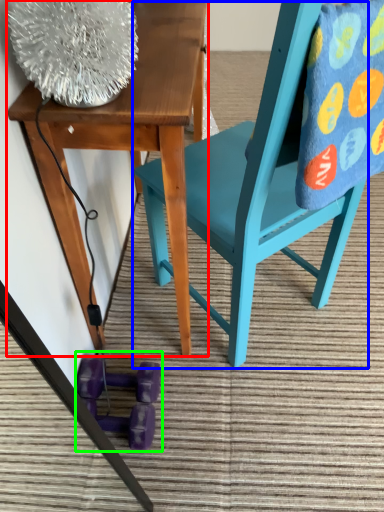
Question: Which object is the farthest from table (highlighted by a red box)? Choose among these: chair (highlighted by a blue box) or toy (highlighted by a green box).

Choices:
 (A) chair
 (B) toy

Answer: (B)